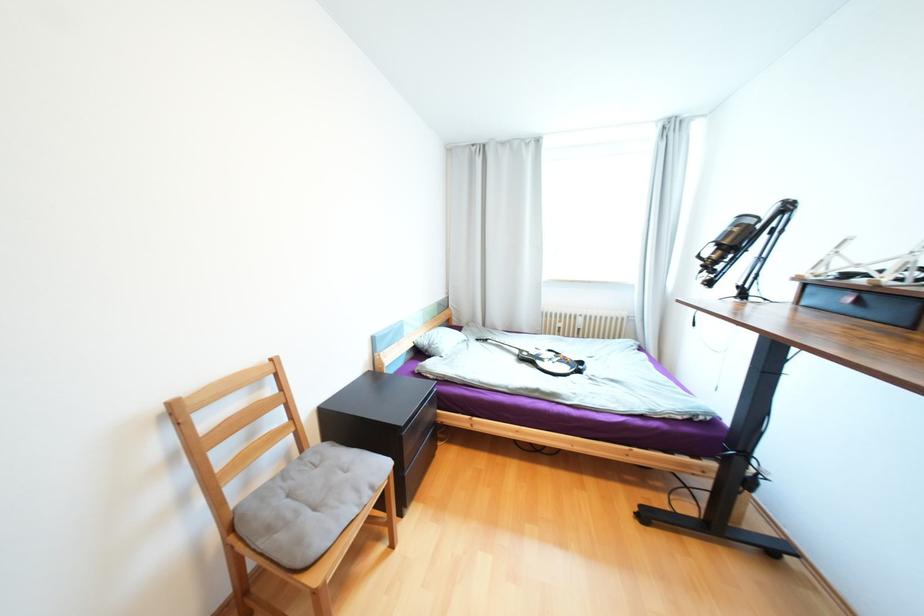
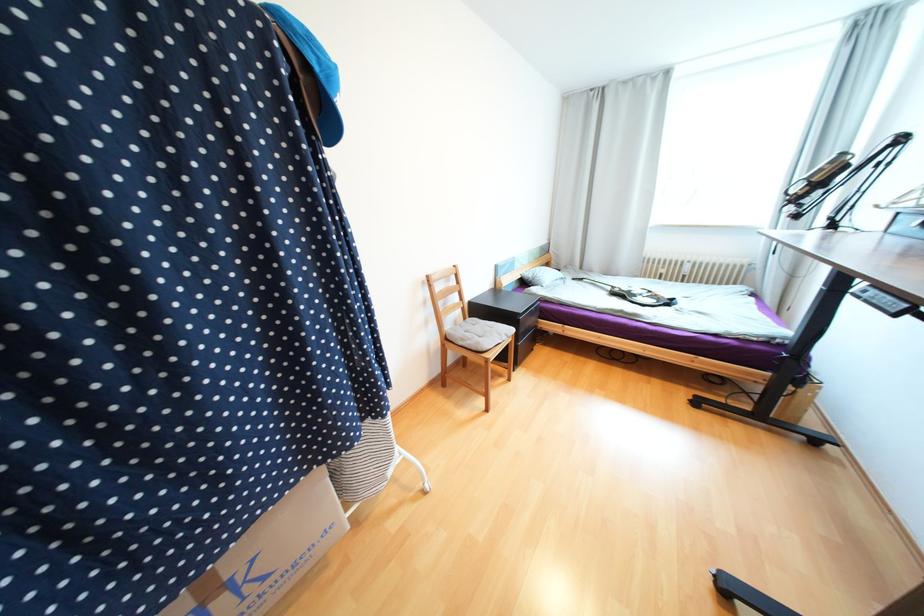
Where in the second image is the point corresponding to the point at 435,346 from the first image?

(540, 278)